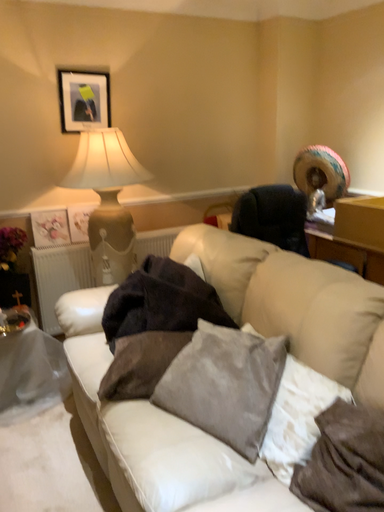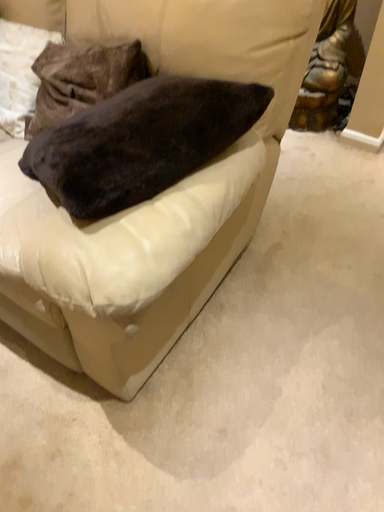
Question: Which way did the camera rotate in the video?

Choices:
 (A) rotated downward
 (B) rotated upward

Answer: (A)